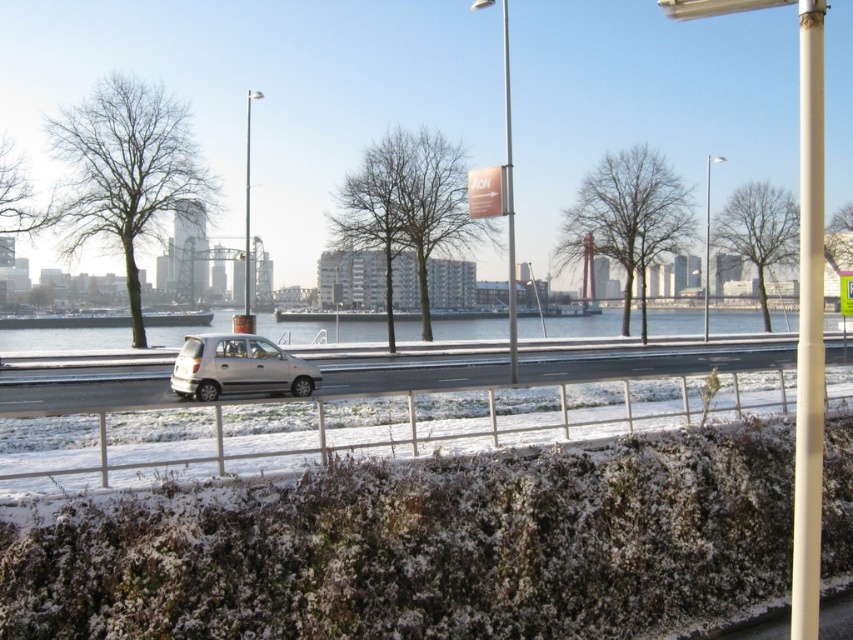
Between white smooth pole at right and silver metallic car at center, which one has less height?

With less height is silver metallic car at center.

Is point (820, 248) farther from camera compared to point (265, 380)?

No, (820, 248) is closer to viewer.

Who is more forward, (809, 272) or (303, 364)?

Point (809, 272) is more forward.

Where is `white smooth pole at right`? white smooth pole at right is located at coordinates (809, 328).

Who is taller, silver metallic car at center or metallic pole at center?

metallic pole at center

Is silver metallic car at center in front of metallic pole at center?

Yes.

Where is `silver metallic car at center`? silver metallic car at center is located at coordinates (238, 368).

Does white matte car at center come behind silver metallic car at center?

No, it is in front of silver metallic car at center.

Is point (4, 381) less distant than point (199, 387)?

No, it is not.

At what (x,y) coordinates should I click in order to perform the action: click on white matte car at center. Please return your answer as a coordinate pair (x, y). This screenshot has width=853, height=640. Looking at the image, I should click on (541, 362).

Where is `white matte car at center`? This screenshot has width=853, height=640. white matte car at center is located at coordinates (541, 362).